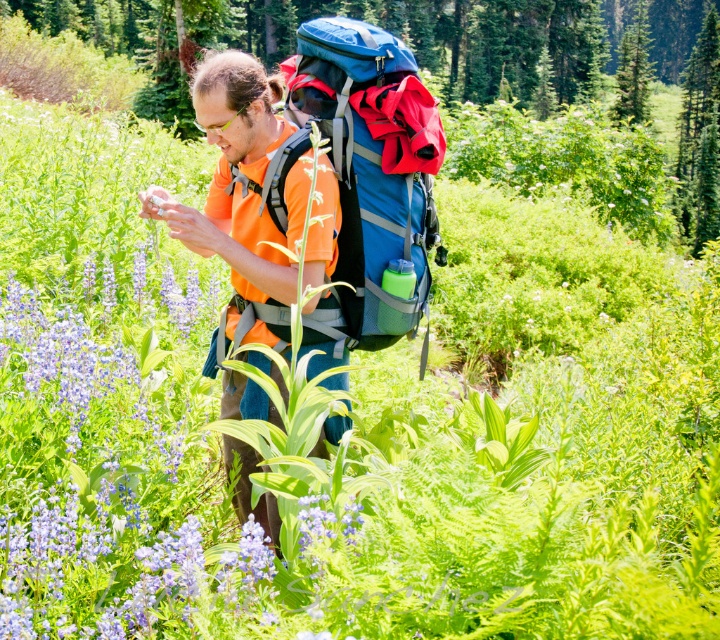
You are a hiker trying to navigate through the area. You see two points marked in the image. Which point is closer to you, point (163, 586) or point (414, 88)?

Point (163, 586) is in front of point (414, 88), so it is closer to you.